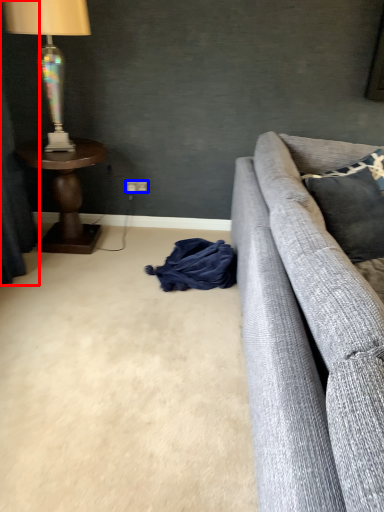
Question: Which object is closer to the camera taking this photo, curtain (highlighted by a red box) or power outlet (highlighted by a blue box)?

Choices:
 (A) curtain
 (B) power outlet

Answer: (A)